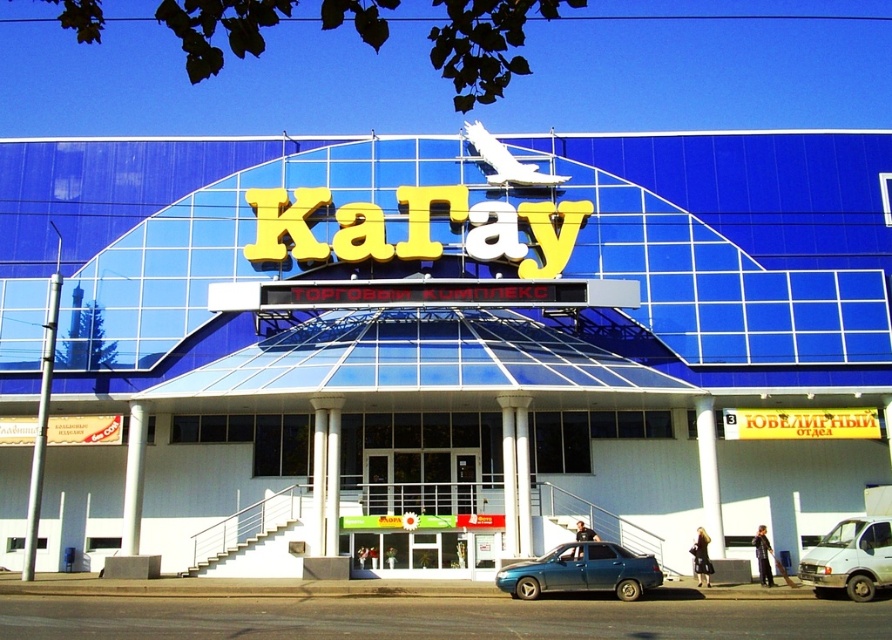
Who is more forward, (370, 284) or (828, 595)?

Positioned in front is point (828, 595).

The height and width of the screenshot is (640, 892). Describe the element at coordinates (446, 336) in the screenshot. I see `blue glass building at center` at that location.

Between point (715, 323) and point (835, 540), which one is positioned in front?

Positioned in front is point (835, 540).

Image resolution: width=892 pixels, height=640 pixels. I want to click on blue glass building at center, so click(x=446, y=336).

Does blue glass building at center appear on the right side of metallic blue sedan at center?

Incorrect, blue glass building at center is not on the right side of metallic blue sedan at center.

Does point (370, 262) come closer to viewer compared to point (585, 566)?

No.

Where is `blue glass building at center`? This screenshot has height=640, width=892. blue glass building at center is located at coordinates (446, 336).

Can you confirm if metallic blue sedan at center is positioned to the left of white matte van at lower right?

Yes, metallic blue sedan at center is to the left of white matte van at lower right.

Which is behind, point (560, 545) or point (822, 538)?

Positioned behind is point (822, 538).

Describe the element at coordinates (581, 572) in the screenshot. I see `metallic blue sedan at center` at that location.

Locate an element on the screen. metallic blue sedan at center is located at coordinates (581, 572).